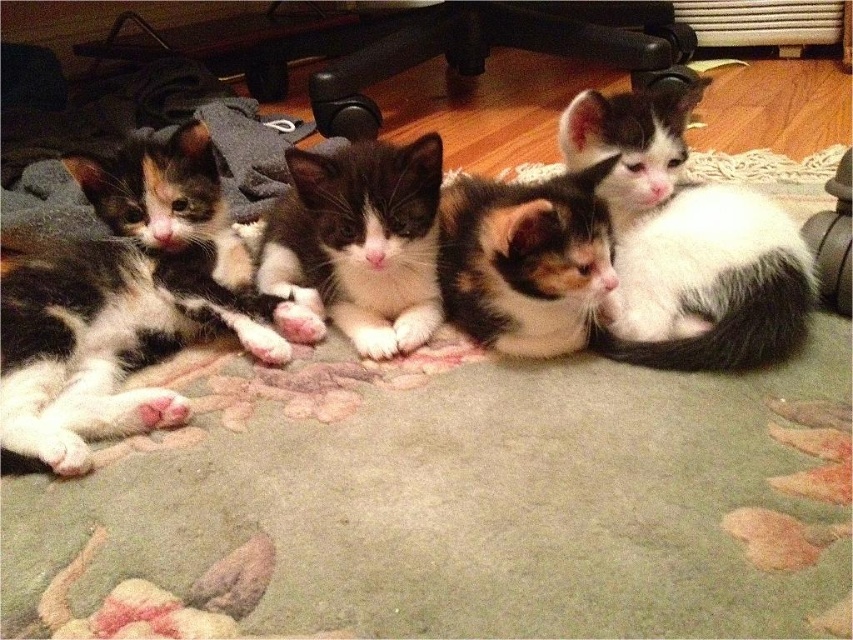
Question: Which of the following is the farthest from the observer?

Choices:
 (A) calico fur cat at center
 (B) white and black fur cat at upper right

Answer: (B)

Question: Is calico fur kitten at left above calico fur cat at center?

Choices:
 (A) yes
 (B) no

Answer: (B)

Question: Is calico fur kitten at left smaller than calico fur cat at center?

Choices:
 (A) no
 (B) yes

Answer: (A)

Question: Which point is closer to the camera?

Choices:
 (A) (479, 307)
 (B) (222, 227)

Answer: (A)

Question: Considering the real-world distances, which object is farthest from the calico fur kitten at left?

Choices:
 (A) calico fur cat at center
 (B) white and black fur cat at upper right
 (C) black and white fur kitten at center

Answer: (B)

Question: Can you confirm if white and black fur cat at upper right is positioned to the left of black and white fur kitten at center?

Choices:
 (A) yes
 (B) no

Answer: (B)